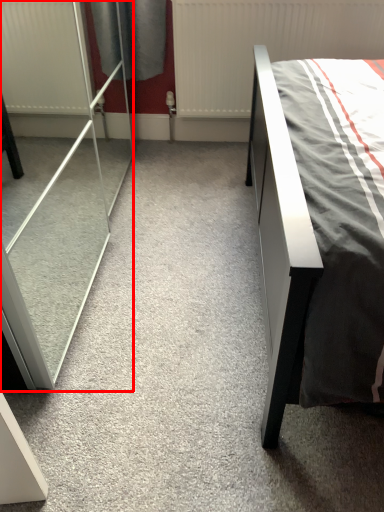
Question: From the image's perspective, considering the relative positions of screen door (annotated by the red box) and radiator in the image provided, where is screen door (annotated by the red box) located with respect to the staircase?

Choices:
 (A) above
 (B) below

Answer: (B)